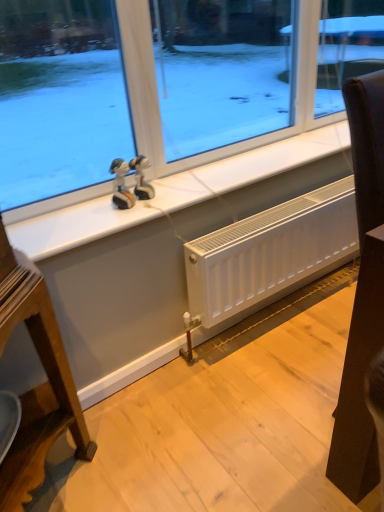
The height and width of the screenshot is (512, 384). I want to click on unoccupied space behind matte plastic figurine at center, the second figurine from the right, so click(x=146, y=188).